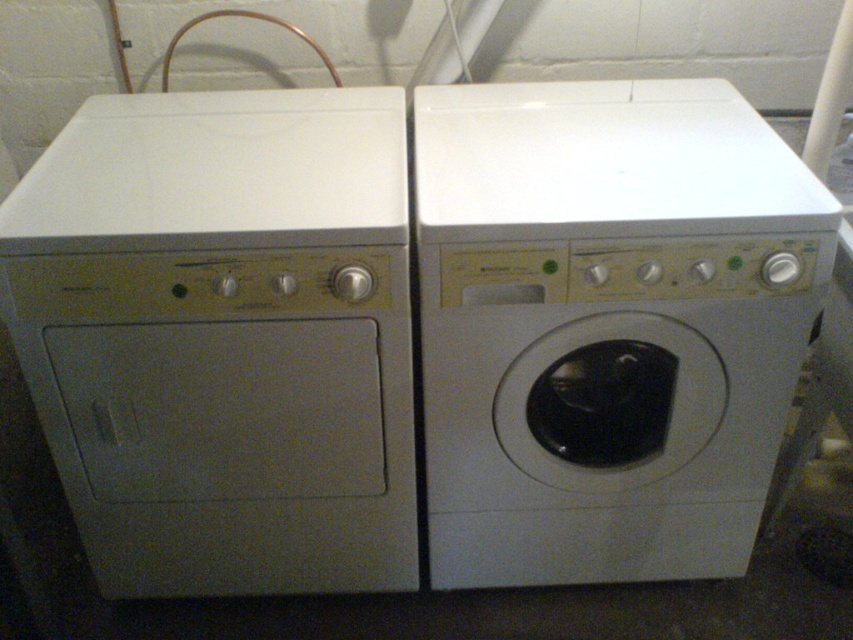
Question: Which object is farther from the camera taking this photo?

Choices:
 (A) white glossy washing machine at center
 (B) white matte washing machine at left

Answer: (A)

Question: Does white matte washing machine at left appear under white glossy washing machine at center?

Choices:
 (A) yes
 (B) no

Answer: (A)

Question: Observing the image, what is the correct spatial positioning of white matte washing machine at left in reference to white glossy washing machine at center?

Choices:
 (A) right
 (B) left

Answer: (B)

Question: Is white matte washing machine at left below white glossy washing machine at center?

Choices:
 (A) no
 (B) yes

Answer: (B)